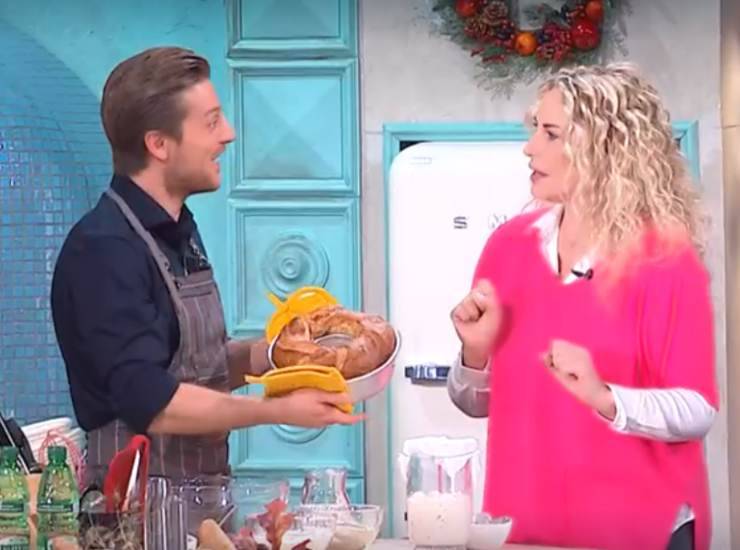
Locate an element on the screen. Image resolution: width=740 pixels, height=550 pixels. bundt pan is located at coordinates (376, 374).